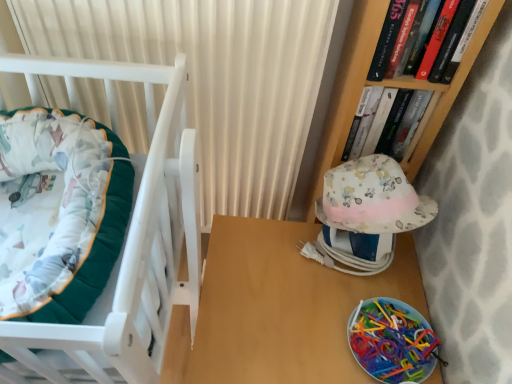
Where is `empty space that is ontop of wooden table at center`? Image resolution: width=512 pixels, height=384 pixels. empty space that is ontop of wooden table at center is located at coordinates (312, 296).